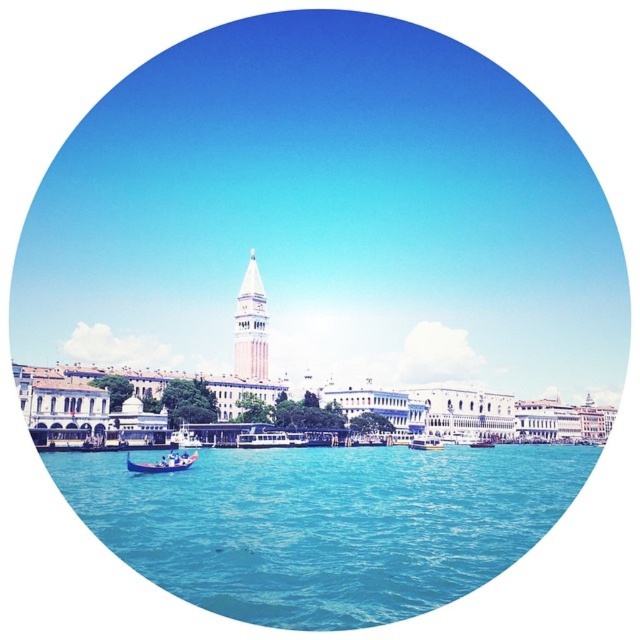
You are a tourist standing on a bridge in Venice and want to take a photo of both the white marble bell tower at center and the metallic silver boat at center. Which object should you focus on first to ensure both are in the frame?

You should focus on the white marble bell tower at center first because it is closer to you than the metallic silver boat at center, so adjusting the frame to include the closer object will naturally include the farther one as well.

You are a tourist standing at the waterfront in Venice, Italy. You see two points marked on the image. The first point is at coordinate point (426,605) and the second point is at coordinate point (252,291). Which point is closer to you?

Point (426,605) is in front of point (252,291), so the first point is closer to you.